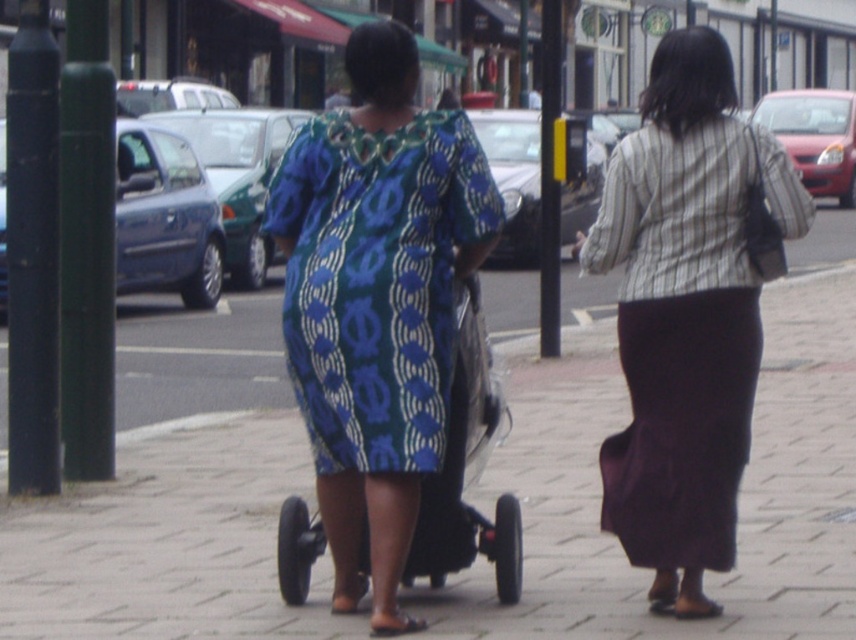
Question: Considering the relative positions of blue printed fabric dress at center and black rubber stroller at center in the image provided, where is blue printed fabric dress at center located with respect to black rubber stroller at center?

Choices:
 (A) right
 (B) left

Answer: (B)

Question: Among these points, which one is nearest to the camera?

Choices:
 (A) (779, 358)
 (B) (458, 488)
 (C) (676, 168)

Answer: (C)

Question: Is blue printed fabric dress at center above black rubber stroller at center?

Choices:
 (A) yes
 (B) no

Answer: (A)

Question: From the image, what is the correct spatial relationship of striped fabric skirt at center in relation to black rubber stroller at center?

Choices:
 (A) right
 (B) left

Answer: (A)

Question: Which point is farther from the camera taking this photo?

Choices:
 (A) (480, 348)
 (B) (676, 97)

Answer: (A)

Question: Which of these objects is positioned closest to the striped fabric skirt at center?

Choices:
 (A) black rubber stroller at center
 (B) blue printed fabric dress at center

Answer: (A)